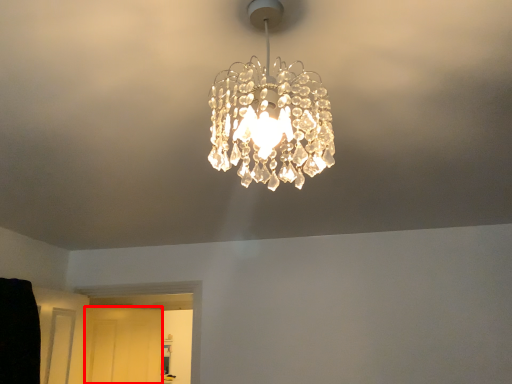
Question: From the image's perspective, considering the relative positions of glass door (annotated by the red box) and lamp in the image provided, where is glass door (annotated by the red box) located with respect to the staircase?

Choices:
 (A) below
 (B) above

Answer: (A)